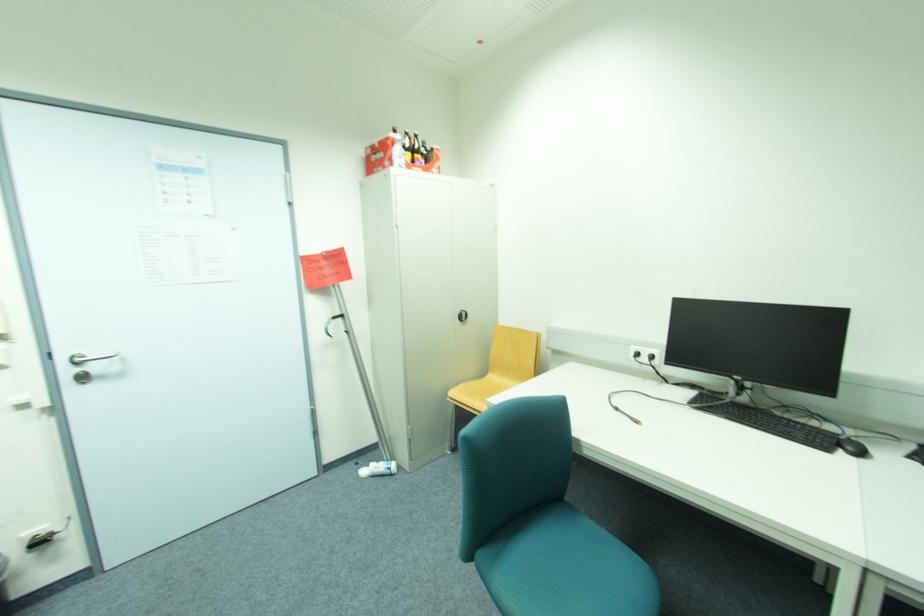
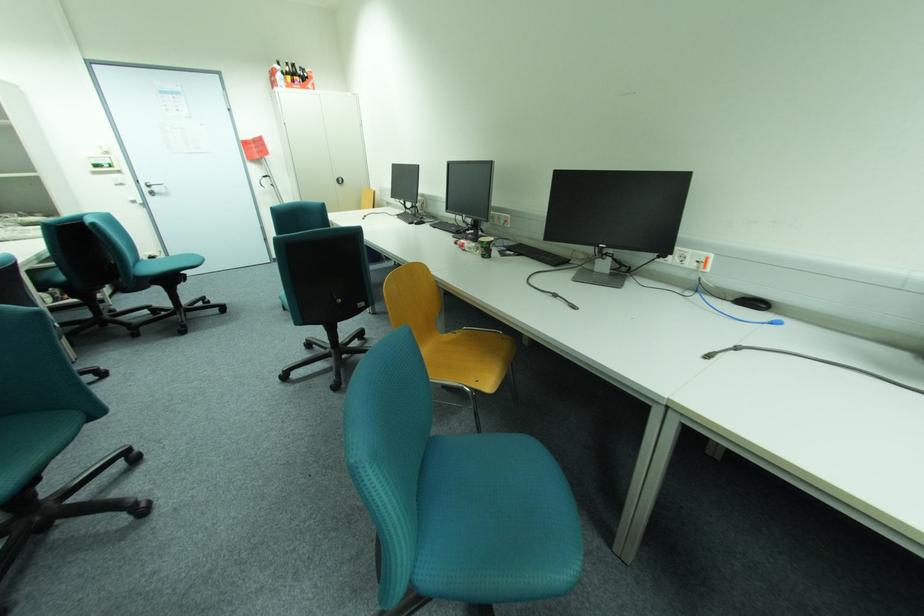
What movement of the cameraman would produce the second image?

The cameraman walked toward right, backward.